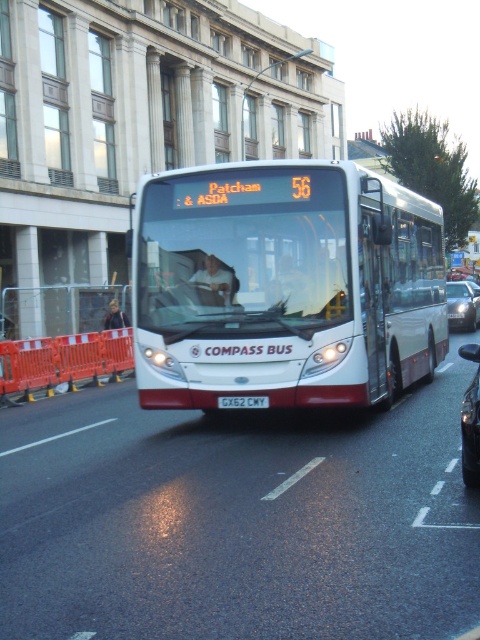
What do you see at coordinates (470, 420) in the screenshot?
I see `metallic silver car at center` at bounding box center [470, 420].

Can you confirm if metallic silver car at center is shorter than white rectangular license plate at center?

No, metallic silver car at center is not shorter than white rectangular license plate at center.

Describe the element at coordinates (470, 420) in the screenshot. I see `metallic silver car at center` at that location.

In order to click on metallic silver car at center in this screenshot , I will do `click(470, 420)`.

Can you confirm if white matte bus at center is positioned above orange plastic barricade at left?

Yes.

Between white matte bus at center and orange plastic barricade at left, which one has more height?

With more height is white matte bus at center.

Is point (231, 275) positioned in front of point (1, 342)?

Yes.

Where is `white matte bus at center`? white matte bus at center is located at coordinates click(x=284, y=285).

Does white matte bus at center have a larger size compared to white rectangular license plate at center?

Yes, white matte bus at center is bigger than white rectangular license plate at center.

Between white matte bus at center and white rectangular license plate at center, which one appears on the left side from the viewer's perspective?

white matte bus at center

Between point (398, 316) and point (254, 401), which one is positioned behind?

Positioned behind is point (398, 316).

This screenshot has height=640, width=480. What are the coordinates of `white matte bus at center` in the screenshot? It's located at (284, 285).